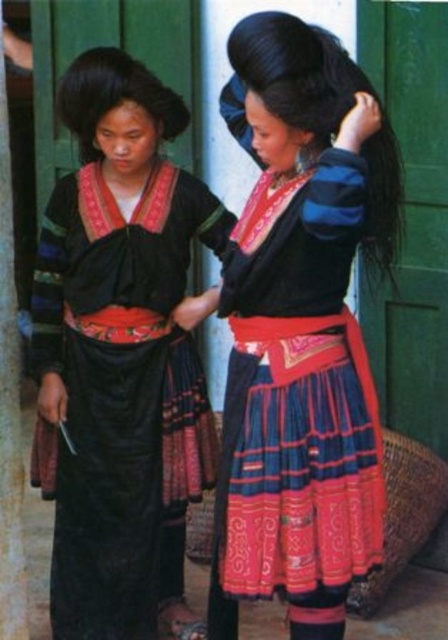
You are a tailor measuring two items in the image. The items are the matte black blouse at upper center and the wooden pole at left. Which item requires a larger measurement tape to cover its full length?

The matte black blouse at upper center requires a larger measurement tape because it is larger in size than the wooden pole at left.